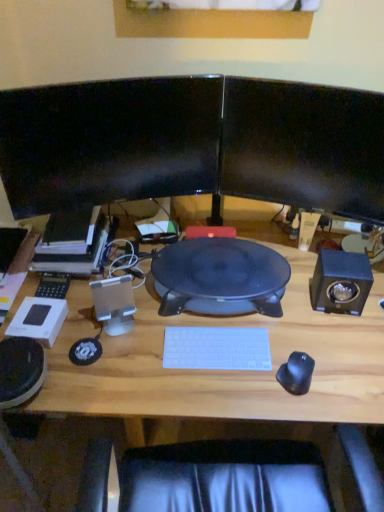
The width and height of the screenshot is (384, 512). I want to click on free point in front of satin black speaker at right, which ranks as the 1th speaker in right-to-left order, so click(339, 342).